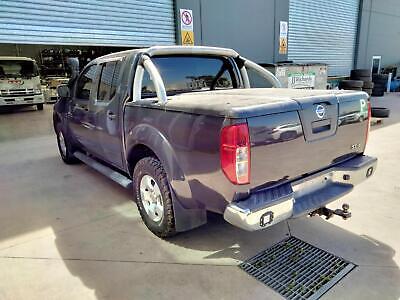
Find the location of a particular element. Image resolution: width=400 pixels, height=300 pixels. grate cover is located at coordinates (304, 266), (307, 276), (307, 261).